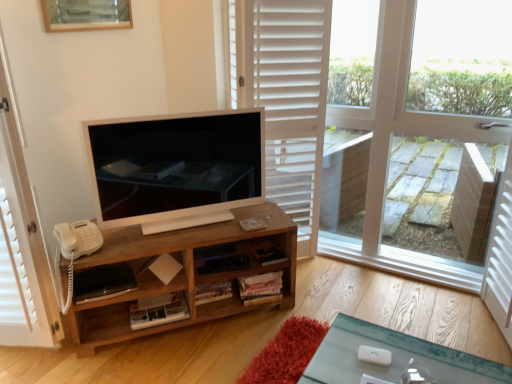
Where is `white wooden screen door at left, marked as the first screen door in a left-to-right arrangement`? This screenshot has width=512, height=384. white wooden screen door at left, marked as the first screen door in a left-to-right arrangement is located at coordinates (21, 238).

Locate an element on the screen. This screenshot has height=384, width=512. wooden picture frame at upper center is located at coordinates (86, 15).

Is white wooden screen door at right, which ranks as the 1th screen door in right-to-left order, situated inside wooden cabinet at center or outside?

white wooden screen door at right, which ranks as the 1th screen door in right-to-left order, lies outside wooden cabinet at center.

Between white wooden screen door at right, the second screen door viewed from the left, and wooden cabinet at center, which one has more height?

white wooden screen door at right, the second screen door viewed from the left, is taller.

Could you tell me if white wooden screen door at right, which ranks as the 1th screen door in right-to-left order, is turned towards wooden cabinet at center?

Yes.

Which is more to the left, white wooden screen door at right, the second screen door viewed from the left, or wooden cabinet at center?

wooden cabinet at center.

Considering the relative sizes of wooden picture frame at upper center and white wooden screen door at right, which ranks as the 1th screen door in right-to-left order, in the image provided, is wooden picture frame at upper center bigger than white wooden screen door at right, which ranks as the 1th screen door in right-to-left order,?

No.

Is wooden picture frame at upper center further to the viewer compared to white wooden screen door at right, which ranks as the 1th screen door in right-to-left order?

That is True.

Is wooden picture frame at upper center oriented towards white wooden screen door at right, which ranks as the 1th screen door in right-to-left order?

No, wooden picture frame at upper center is not facing towards white wooden screen door at right, which ranks as the 1th screen door in right-to-left order.

Does point (423, 254) appear closer or farther from the camera than point (169, 129)?

Clearly, point (423, 254) is more distant from the camera than point (169, 129).

Is the position of transparent glass window at center more distant than that of satin white television at center?

No, transparent glass window at center is closer to the viewer.

Is transparent glass window at center facing away from satin white television at center?

transparent glass window at center does not have its back to satin white television at center.

In the scene shown: Are transparent glass window at center and satin white television at center far apart?

transparent glass window at center is actually quite close to satin white television at center.

Would you say transparent glass window at center contains wooden picture frame at upper center?

No, wooden picture frame at upper center is not inside transparent glass window at center.

Considering the sizes of transparent glass window at center and wooden picture frame at upper center in the image, is transparent glass window at center wider or thinner than wooden picture frame at upper center?

transparent glass window at center is wider than wooden picture frame at upper center.

Based on their sizes in the image, would you say transparent glass window at center is bigger or smaller than wooden picture frame at upper center?

transparent glass window at center is bigger than wooden picture frame at upper center.

Can you confirm if transparent glass window at center is shorter than wooden picture frame at upper center?

In fact, transparent glass window at center may be taller than wooden picture frame at upper center.

From the image's perspective, would you say wooden picture frame at upper center is positioned over white wooden screen door at left, marked as the first screen door in a left-to-right arrangement?

Correct, wooden picture frame at upper center appears higher than white wooden screen door at left, marked as the first screen door in a left-to-right arrangement, in the image.

Are wooden picture frame at upper center and white wooden screen door at left, which is counted as the second screen door, starting from the right, beside each other?

No, wooden picture frame at upper center is not beside white wooden screen door at left, which is counted as the second screen door, starting from the right.

Which is behind, point (56, 30) or point (52, 333)?

Point (56, 30)

Who is smaller, wooden picture frame at upper center or white wooden screen door at left, which is counted as the second screen door, starting from the right?

With smaller size is wooden picture frame at upper center.

What's the angular difference between wooden cabinet at center and white wooden screen door at right, which ranks as the 1th screen door in right-to-left order,'s facing directions?

The angular difference between wooden cabinet at center and white wooden screen door at right, which ranks as the 1th screen door in right-to-left order, is 121 degrees.

Is the surface of wooden cabinet at center in direct contact with white wooden screen door at right, the second screen door viewed from the left?

No.

Who is shorter, wooden cabinet at center or white wooden screen door at right, which ranks as the 1th screen door in right-to-left order?

wooden cabinet at center.

From the image's perspective, is wooden cabinet at center located above white wooden screen door at right, the second screen door viewed from the left?

Incorrect, from the image's perspective, wooden cabinet at center is lower than white wooden screen door at right, the second screen door viewed from the left.

From the picture: Is transparent glass window at center placed right next to white wooden screen door at right, the second screen door viewed from the left?

No, transparent glass window at center is not with white wooden screen door at right, the second screen door viewed from the left.

Could you tell me if transparent glass window at center is facing white wooden screen door at right, which ranks as the 1th screen door in right-to-left order?

Yes.

Which of these two, transparent glass window at center or white wooden screen door at right, which ranks as the 1th screen door in right-to-left order, is smaller?

white wooden screen door at right, which ranks as the 1th screen door in right-to-left order.

Identify the location of screen door on the right of the wooden cabinet at center. The height and width of the screenshot is (384, 512). (500, 256).

You are a GUI agent. You are given a task and a screenshot of the screen. Output one action in this format:
    pyautogui.click(x=<x>, y=<y>)
    Task: Click on the picture frame above the white wooden screen door at right, which ranks as the 1th screen door in right-to-left order (from the image's perspective)
    This screenshot has height=384, width=512.
    Given the screenshot: What is the action you would take?
    pyautogui.click(x=86, y=15)

Which object lies nearer to the anchor point satin white television at center, wooden cabinet at center or wooden picture frame at upper center?

wooden cabinet at center is positioned closer to the anchor satin white television at center.

Looking at the image, which one is located closer to satin white television at center, wooden cabinet at center or white wooden screen door at right, which ranks as the 1th screen door in right-to-left order?

wooden cabinet at center.

Based on their spatial positions, is transparent glass window at center or white wooden screen door at left, marked as the first screen door in a left-to-right arrangement, closer to wooden cabinet at center?

white wooden screen door at left, marked as the first screen door in a left-to-right arrangement, is positioned closer to the anchor wooden cabinet at center.

Looking at the image, which one is located further to white wooden screen door at right, the second screen door viewed from the left, satin white television at center or wooden cabinet at center?

satin white television at center lies further to white wooden screen door at right, the second screen door viewed from the left, than the other object.

Estimate the real-world distances between objects in this image. Which object is closer to white wooden screen door at right, which ranks as the 1th screen door in right-to-left order, wooden cabinet at center or white wooden screen door at left, marked as the first screen door in a left-to-right arrangement?

The object closer to white wooden screen door at right, which ranks as the 1th screen door in right-to-left order, is wooden cabinet at center.

Estimate the real-world distances between objects in this image. Which object is further from white wooden screen door at left, marked as the first screen door in a left-to-right arrangement, white wooden screen door at right, which ranks as the 1th screen door in right-to-left order, or transparent glass window at center?

white wooden screen door at right, which ranks as the 1th screen door in right-to-left order, is further to white wooden screen door at left, marked as the first screen door in a left-to-right arrangement.

Considering their positions, is satin white television at center positioned further to wooden cabinet at center than white wooden screen door at left, which is counted as the second screen door, starting from the right?

white wooden screen door at left, which is counted as the second screen door, starting from the right.

Based on their spatial positions, is wooden cabinet at center or white wooden screen door at left, marked as the first screen door in a left-to-right arrangement, closer to transparent glass window at center?

wooden cabinet at center lies closer to transparent glass window at center than the other object.

This screenshot has width=512, height=384. Identify the location of television located between wooden picture frame at upper center and transparent glass window at center in the left-right direction. (176, 167).

The width and height of the screenshot is (512, 384). What are the coordinates of `television that lies between wooden picture frame at upper center and white wooden screen door at left, which is counted as the second screen door, starting from the right, from top to bottom` in the screenshot? It's located at (176, 167).

The height and width of the screenshot is (384, 512). I want to click on cabinetry located between wooden picture frame at upper center and white wooden screen door at right, which ranks as the 1th screen door in right-to-left order, in the left-right direction, so click(182, 272).

Locate an element on the screen. cabinetry located between wooden picture frame at upper center and transparent glass window at center in the left-right direction is located at coordinates (182, 272).